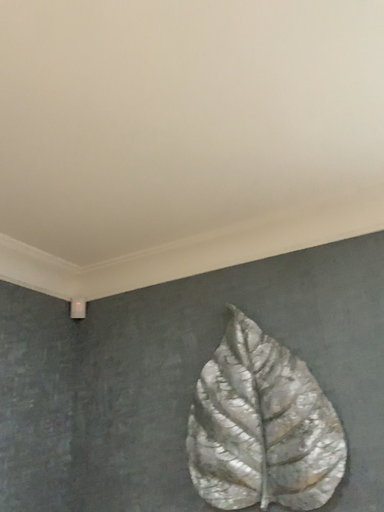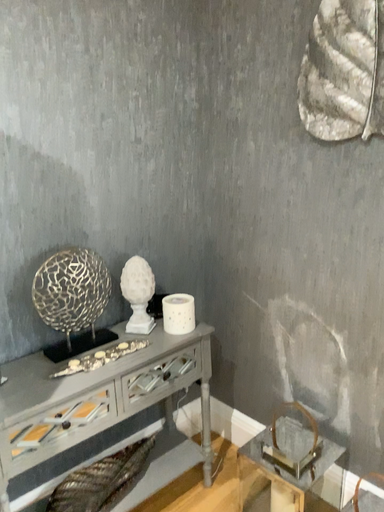
Question: How did the camera likely rotate when shooting the video?

Choices:
 (A) rotated left
 (B) rotated right

Answer: (A)